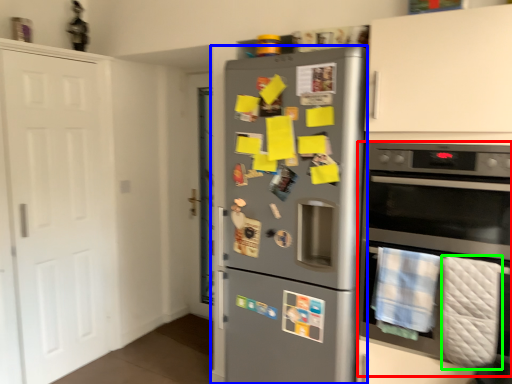
Question: Considering the real-world distances, which object is closest to oven (highlighted by a red box)? refrigerator (highlighted by a blue box) or blanket (highlighted by a green box).

Choices:
 (A) refrigerator
 (B) blanket

Answer: (B)